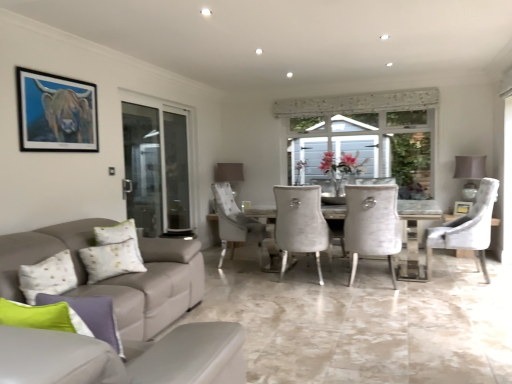
What do you see at coordinates (156, 168) in the screenshot? I see `transparent glass screen door at left` at bounding box center [156, 168].

Locate an element on the screen. This screenshot has width=512, height=384. light gray fabric couch at lower left is located at coordinates (120, 317).

What do you see at coordinates (111, 260) in the screenshot? The image size is (512, 384). I see `white textured pillow at lower left, which is the 2th pillow in right-to-left order` at bounding box center [111, 260].

Image resolution: width=512 pixels, height=384 pixels. Identify the location of white textured chair at center, which is the 2th chair from right to left. (372, 224).

What is the approximate width of matte gray lampshade at upper center, the first lamp from the back?

14.97 inches.

You are a GUI agent. You are given a task and a screenshot of the screen. Output one action in this format:
    pyautogui.click(x=<x>, y=<y>)
    Task: Click on the transparent glass screen door at left
    Image resolution: width=512 pixels, height=384 pixels.
    Given the screenshot: What is the action you would take?
    [156, 168]

Consider the image. What's the angular difference between light gray fabric couch at lower left and matte gray lampshade at upper center, arranged as the second lamp when viewed from the right,'s facing directions?

They differ by 170 degrees in their facing directions.

Choose the correct answer: Is light gray fabric couch at lower left inside matte gray lampshade at upper center, the first lamp positioned from the left, or outside it?

light gray fabric couch at lower left lies outside matte gray lampshade at upper center, the first lamp positioned from the left.

Which is in front, point (28, 365) or point (222, 163)?

The point (28, 365) is closer.

Which is more to the right, light gray fabric couch at lower left or matte gray lampshade at upper center, which appears as the 2th lamp when viewed from the front?

Positioned to the right is matte gray lampshade at upper center, which appears as the 2th lamp when viewed from the front.

Between point (466, 187) and point (55, 109), which one is positioned behind?

Positioned behind is point (466, 187).

Consider the image. Between white fabric lampshade at right, which is the 2th lamp from left to right, and matte black frame at upper left, positioned as the first picture frame in left-to-right order, which one has less height?

matte black frame at upper left, positioned as the first picture frame in left-to-right order.

Is white fabric lampshade at right, acting as the first lamp starting from the right, at the right side of matte black frame at upper left, which appears as the second picture frame when ordered from the bottom?

Correct, you'll find white fabric lampshade at right, acting as the first lamp starting from the right, to the right of matte black frame at upper left, which appears as the second picture frame when ordered from the bottom.

In the image, there is a white fabric lampshade at right, which is the 2th lamp from left to right. In order to click on picture frame above it (from the image's perspective) in this screenshot , I will do `click(56, 113)`.

Could you tell me if transparent glass screen door at left is turned towards green fabric pillow at lower left, the second pillow from the back?

No, transparent glass screen door at left does not turn towards green fabric pillow at lower left, the second pillow from the back.

From the image's perspective, which object appears higher, transparent glass screen door at left or green fabric pillow at lower left, the first pillow from the front?

transparent glass screen door at left is shown above in the image.

Which is behind, point (167, 129) or point (103, 309)?

The point (167, 129) is behind.

Is transparent glass screen door at left completely or partially outside of green fabric pillow at lower left, the second pillow from the back?

Yes.

Is velvet white chair at right, placed as the 1th chair when sorted from right to left, not near matte black frame at upper left, placed as the 2th picture frame when sorted from back to front?

Yes, velvet white chair at right, placed as the 1th chair when sorted from right to left, and matte black frame at upper left, placed as the 2th picture frame when sorted from back to front, are located far from each other.

You are a GUI agent. You are given a task and a screenshot of the screen. Output one action in this format:
    pyautogui.click(x=<x>, y=<y>)
    Task: Click on the 2nd chair behind the matte black frame at upper left, the first picture frame viewed from the front, counting from the anchor's position
    This screenshot has height=384, width=512.
    Given the screenshot: What is the action you would take?
    pyautogui.click(x=467, y=228)

Is velvet white chair at right, the 2th chair viewed from the left, in front of matte black frame at upper left, the first picture frame viewed from the front?

No, velvet white chair at right, the 2th chair viewed from the left, is further to the viewer.

Who is bigger, velvet white chair at right, placed as the 1th chair when sorted from right to left, or matte black frame at upper left, the first picture frame viewed from the front?

velvet white chair at right, placed as the 1th chair when sorted from right to left.

Is matte black frame at upper left, the first picture frame in the top-to-bottom sequence, located outside light gray fabric couch at lower left?

matte black frame at upper left, the first picture frame in the top-to-bottom sequence, lies outside light gray fabric couch at lower left's area.

Considering the sizes of matte black frame at upper left, which appears as the second picture frame when ordered from the bottom, and light gray fabric couch at lower left in the image, is matte black frame at upper left, which appears as the second picture frame when ordered from the bottom, bigger or smaller than light gray fabric couch at lower left?

Clearly, matte black frame at upper left, which appears as the second picture frame when ordered from the bottom, is smaller in size than light gray fabric couch at lower left.

Does point (55, 137) appear closer or farther from the camera than point (64, 369)?

Point (55, 137) appears to be farther away from the viewer than point (64, 369).

What's the angular difference between matte black frame at upper left, the first picture frame viewed from the front, and light gray fabric couch at lower left's facing directions?

The angular difference between matte black frame at upper left, the first picture frame viewed from the front, and light gray fabric couch at lower left is 80.7 degrees.

Which object is closer to the camera taking this photo, transparent glass screen door at left or light gray fabric couch at lower left?

Positioned in front is light gray fabric couch at lower left.

In terms of width, does transparent glass screen door at left look wider or thinner when compared to light gray fabric couch at lower left?

Considering their sizes, transparent glass screen door at left looks slimmer than light gray fabric couch at lower left.

Considering the relative positions of transparent glass screen door at left and light gray fabric couch at lower left in the image provided, is transparent glass screen door at left to the right of light gray fabric couch at lower left from the viewer's perspective?

In fact, transparent glass screen door at left is to the left of light gray fabric couch at lower left.

From the image's perspective, count 1st lamps upward from the green fabric pillow at lower left, the first pillow positioned from the right, and point to it. Please provide its 2D coordinates.

[(229, 172)]

Choose the correct answer: Is green fabric pillow at lower left, the first pillow from the front, inside matte gray lampshade at upper center, the first lamp positioned from the left, or outside it?

green fabric pillow at lower left, the first pillow from the front, lies outside matte gray lampshade at upper center, the first lamp positioned from the left.

From the image's perspective, is green fabric pillow at lower left, the first pillow from the front, located beneath matte gray lampshade at upper center, the first lamp from the back?

Indeed, from the image's perspective, green fabric pillow at lower left, the first pillow from the front, is shown beneath matte gray lampshade at upper center, the first lamp from the back.

Based on their positions, is green fabric pillow at lower left, the second pillow from the back, located to the left or right of matte gray lampshade at upper center, the first lamp from the back?

Clearly, green fabric pillow at lower left, the second pillow from the back, is on the left of matte gray lampshade at upper center, the first lamp from the back, in the image.

I want to click on the 1st lamp positioned above the light gray fabric couch at lower left (from a real-world perspective), so click(x=229, y=172).

Where is `the 2nd picture frame to the left of the white fabric lampshade at right, arranged as the second lamp when viewed from the back, counting from the anchor's position`? The image size is (512, 384). the 2nd picture frame to the left of the white fabric lampshade at right, arranged as the second lamp when viewed from the back, counting from the anchor's position is located at coordinates (56, 113).

Estimate the real-world distances between objects in this image. Which object is closer to light gray fabric couch at lower left, green fabric pillow at lower left, arranged as the second pillow when viewed from the left, or transparent glass screen door at left?

Among the two, green fabric pillow at lower left, arranged as the second pillow when viewed from the left, is located nearer to light gray fabric couch at lower left.

From the picture: From the image, which object appears to be farther from transparent glass screen door at left, white textured chair at center, which is the 2th chair from right to left, or green fabric pillow at lower left, the first pillow from the front?

green fabric pillow at lower left, the first pillow from the front, is further to transparent glass screen door at left.

Based on their spatial positions, is white textured chair at center, which is the 2th chair from right to left, or matte black frame at upper left, which appears as the second picture frame when ordered from the bottom, further from velvet white chair at right, placed as the 1th chair when sorted from right to left?

matte black frame at upper left, which appears as the second picture frame when ordered from the bottom, is positioned further to the anchor velvet white chair at right, placed as the 1th chair when sorted from right to left.

Looking at the image, which one is located further to green fabric pillow at lower left, the second pillow from the back, matte black frame at upper left, positioned as the first picture frame in left-to-right order, or velvet white chair at right, the 2th chair viewed from the left?

velvet white chair at right, the 2th chair viewed from the left.

Which object lies nearer to the anchor point light gray fabric couch at lower left, white textured pillow at lower left, which is counted as the first pillow, starting from the left, or transparent glass screen door at left?

white textured pillow at lower left, which is counted as the first pillow, starting from the left, lies closer to light gray fabric couch at lower left than the other object.

Estimate the real-world distances between objects in this image. Which object is closer to matte gray lampshade at upper center, arranged as the second lamp when viewed from the right, white textured chair at center, marked as the first chair in a left-to-right arrangement, or light gray fabric couch at lower left?

The object closer to matte gray lampshade at upper center, arranged as the second lamp when viewed from the right, is white textured chair at center, marked as the first chair in a left-to-right arrangement.

Estimate the real-world distances between objects in this image. Which object is further from transparent glass screen door at left, green fabric pillow at lower left, the first pillow positioned from the right, or wooden picture frame at center, positioned as the 2th picture frame in front-to-back order?

wooden picture frame at center, positioned as the 2th picture frame in front-to-back order, is further to transparent glass screen door at left.

Considering their positions, is velvet white chair at right, placed as the 1th chair when sorted from right to left, positioned further to transparent glass screen door at left than matte black frame at upper left, marked as the 2th picture frame in a right-to-left arrangement?

Among the two, velvet white chair at right, placed as the 1th chair when sorted from right to left, is located further to transparent glass screen door at left.

Where is `chair between white textured chair at center, marked as the first chair in a left-to-right arrangement, and matte gray lampshade at upper center, the first lamp positioned from the left, from front to back`? chair between white textured chair at center, marked as the first chair in a left-to-right arrangement, and matte gray lampshade at upper center, the first lamp positioned from the left, from front to back is located at coordinates (467, 228).

The width and height of the screenshot is (512, 384). I want to click on lamp between matte black frame at upper left, placed as the 2th picture frame when sorted from back to front, and velvet white chair at right, placed as the 1th chair when sorted from right to left, in the horizontal direction, so click(229, 172).

At what (x,y) coordinates should I click in order to perform the action: click on screen door situated between matte black frame at upper left, the first picture frame viewed from the front, and wooden picture frame at center, positioned as the 2th picture frame in front-to-back order, from left to right. Please return your answer as a coordinate pair (x, y). Image resolution: width=512 pixels, height=384 pixels. Looking at the image, I should click on (156, 168).

Find the location of a particular element. The height and width of the screenshot is (384, 512). pillow between green fabric pillow at lower left, the first pillow from the front, and transparent glass screen door at left in the front-back direction is located at coordinates (111, 260).